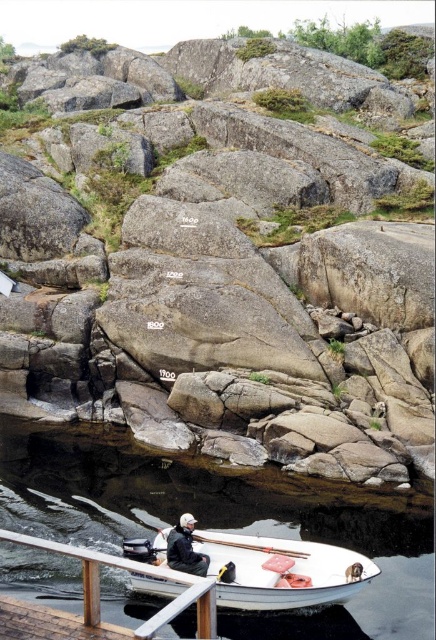
You are a lifeguard observing the coastal scene. You notice the white matte boat at lower center and the dark gray fabric jacket at lower center. Which object is taller?

The white matte boat at lower center is taller than the dark gray fabric jacket at lower center according to the description.

You are a photographer standing at the pier trying to capture both the dark gray fabric jacket at lower center and the wooden smooth paddle at lower center in a single shot. Which object should you focus on first to ensure both are in frame?

Answer: You should focus on the dark gray fabric jacket at lower center first because it is larger in size than the wooden smooth paddle at lower center, so centering it will allow the smaller paddle to fit within the frame more easily.